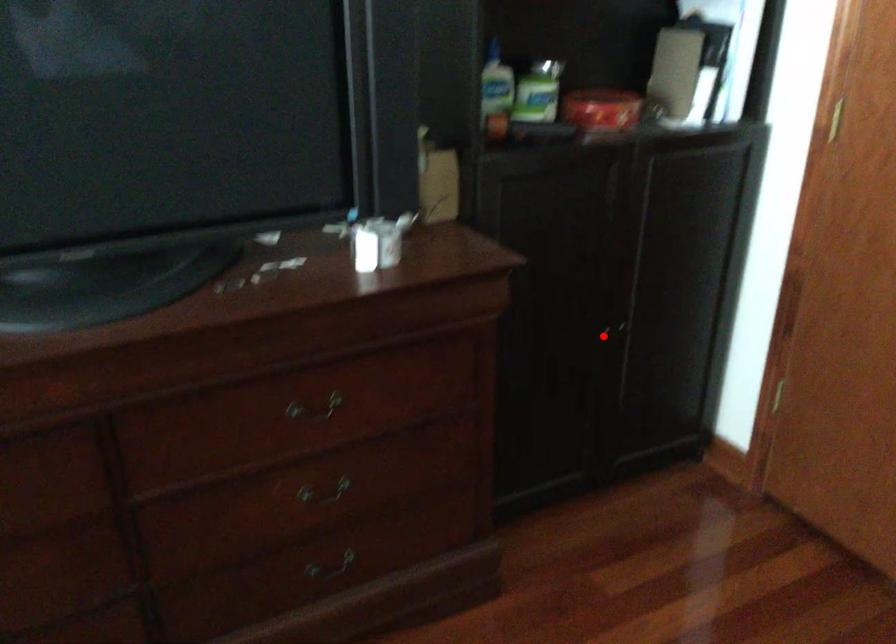
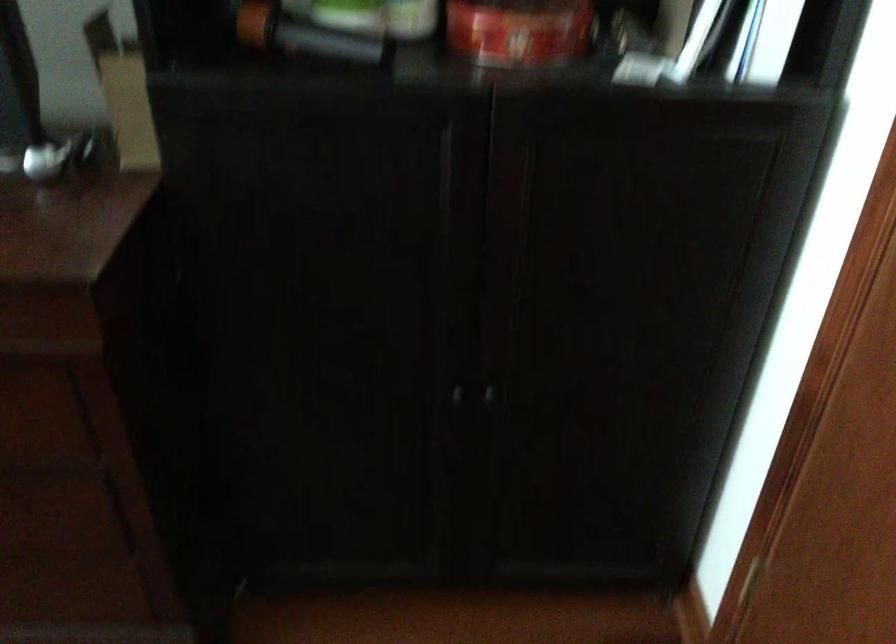
Question: I am providing you with two images of the same scene from different viewpoints. A red point is shown in image1. For the corresponding object point in image2, is it positioned nearer or farther from the camera?

Choices:
 (A) Nearer
 (B) Farther

Answer: (A)